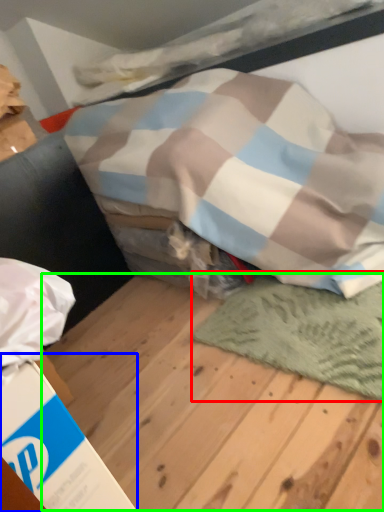
Question: Which is farther away from mat (highlighted by a red box)? cardboard box (highlighted by a blue box) or plywood (highlighted by a green box)?

Choices:
 (A) cardboard box
 (B) plywood

Answer: (A)